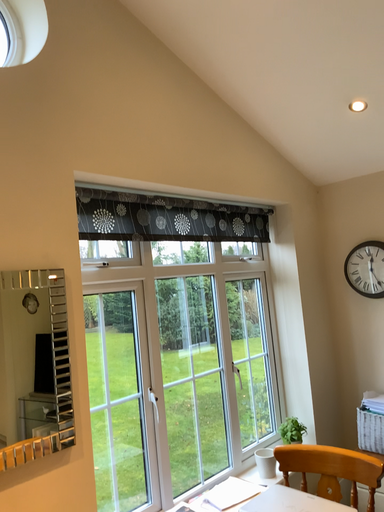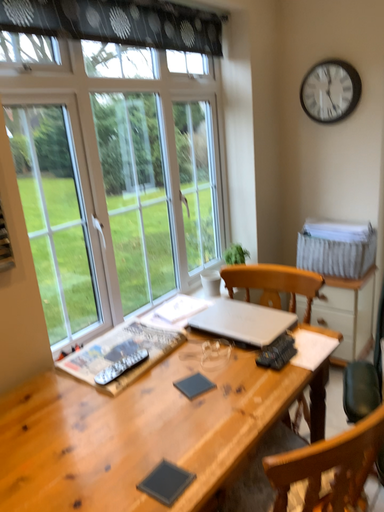
Question: How did the camera likely rotate when shooting the video?

Choices:
 (A) rotated downward
 (B) rotated upward

Answer: (A)